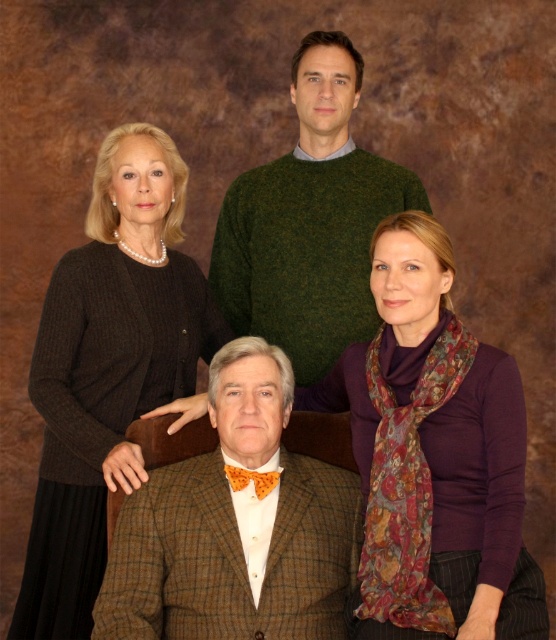
Between dark brown knit sweater at left and green wool sweater at upper center, which one is positioned lower?

dark brown knit sweater at left

Who is more distant from viewer, (x=93, y=438) or (x=360, y=301)?

Positioned behind is point (x=360, y=301).

You are a GUI agent. You are given a task and a screenshot of the screen. Output one action in this format:
    pyautogui.click(x=<x>, y=<y>)
    Task: Click on the dark brown knit sweater at left
    Image resolution: width=556 pixels, height=640 pixels.
    Given the screenshot: What is the action you would take?
    pyautogui.click(x=110, y=369)

Is purple silk scarf at lower right further to the viewer compared to brown tweed suit at center?

No, it is in front of brown tweed suit at center.

Does purple silk scarf at lower right have a lesser width compared to brown tweed suit at center?

Yes.

Identify the location of purple silk scarf at lower right. Image resolution: width=556 pixels, height=640 pixels. (434, 456).

Between purple silk scarf at lower right and dark brown knit sweater at left, which one has more height?

With more height is dark brown knit sweater at left.

Based on the photo, how far apart are purple silk scarf at lower right and dark brown knit sweater at left?

21.55 inches

Is point (458, 499) positioned in front of point (151, 184)?

Yes, it is.

This screenshot has height=640, width=556. In order to click on purple silk scarf at lower right in this screenshot , I will do `click(434, 456)`.